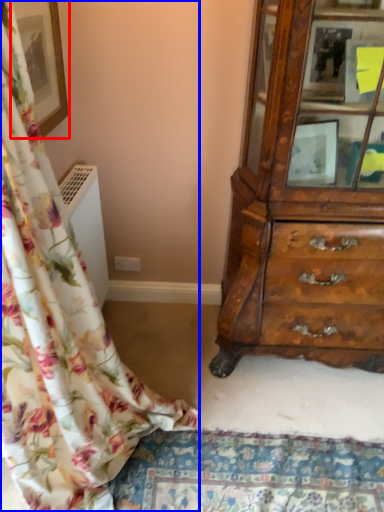
Question: Which object is closer to the camera taking this photo, picture frame (highlighted by a red box) or curtain (highlighted by a blue box)?

Choices:
 (A) picture frame
 (B) curtain

Answer: (B)